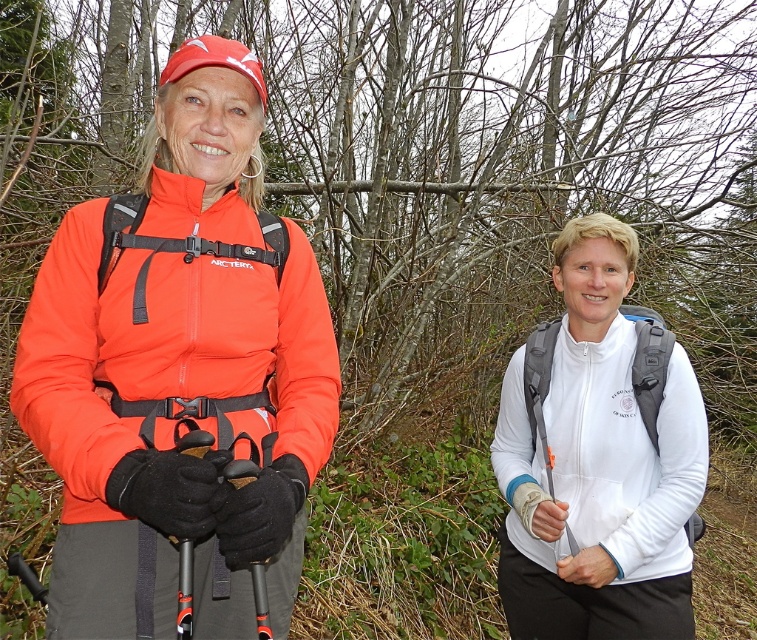
You are a photographer trying to capture the matte orange jacket at left in the frame. Based on its coordinates, where should you position your camera to ensure it is centered?

The matte orange jacket at left is located at coordinates point (167, 352), so positioning the camera to center on those coordinates would ensure the jacket is centered in the frame.

You are a hiker who needs to pass by the two people in the image. The path is narrow, and your backpack is 0.5 meters wide. The person with the matte orange jacket at left is standing still, while the other person is moving towards you. Can you safely pass between them without squeezing?

The two individuals are 1.14 meters apart. Since your backpack is 0.5 meters wide, there is enough space between them to pass safely without squeezing.

Looking at this image, you are planning to take a photo of the scene. You want to ensure both the white matte jacket at right and the black rubber ski pole at center are visible in the frame. Based on their positions, which object is closer to the camera?

The white matte jacket at right is positioned over the black rubber ski pole at center, meaning it is closer to the camera.